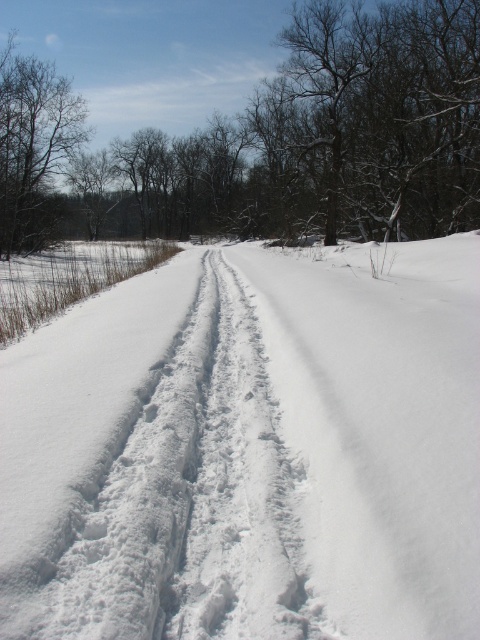
Question: Among these objects, which one is farthest from the camera?

Choices:
 (A) brown textured tree at left
 (B) white fluffy snow at center
 (C) brown textured tree at upper center

Answer: (A)

Question: Among these objects, which one is farthest from the camera?

Choices:
 (A) brown textured tree at left
 (B) white fluffy snow at center

Answer: (A)

Question: Is brown textured tree at upper center in front of brown textured tree at left?

Choices:
 (A) yes
 (B) no

Answer: (A)

Question: Observing the image, what is the correct spatial positioning of white fluffy snow at center in reference to brown textured tree at upper center?

Choices:
 (A) above
 (B) below

Answer: (B)

Question: Is white fluffy snow at center further to camera compared to brown textured tree at left?

Choices:
 (A) no
 (B) yes

Answer: (A)

Question: Which of these objects is positioned farthest from the brown textured tree at upper center?

Choices:
 (A) brown textured tree at left
 (B) white fluffy snow at center

Answer: (B)